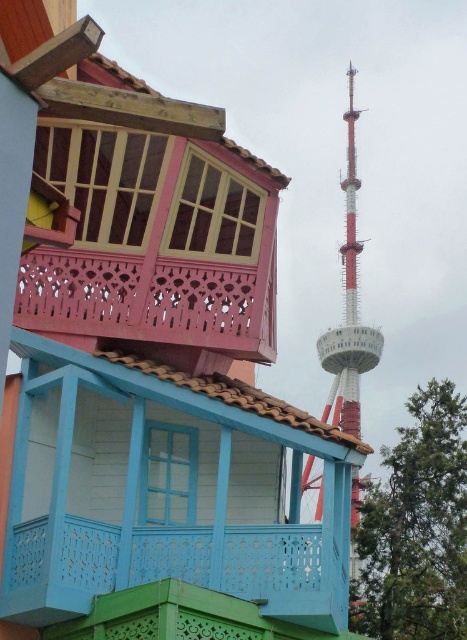
Question: Is pink woodwork balcony at upper left to the right of red and white painted tower at upper right from the viewer's perspective?

Choices:
 (A) no
 (B) yes

Answer: (A)

Question: Can you confirm if blue painted wood balcony at center is smaller than red and white painted tower at upper right?

Choices:
 (A) no
 (B) yes

Answer: (B)

Question: Which is farther from the pink woodwork balcony at upper left?

Choices:
 (A) blue painted wood balcony at center
 (B) red and white painted tower at upper right

Answer: (B)

Question: Does blue painted wood balcony at center come behind red and white painted tower at upper right?

Choices:
 (A) yes
 (B) no

Answer: (B)

Question: Which object is closer to the camera taking this photo?

Choices:
 (A) pink woodwork balcony at upper left
 (B) red and white painted tower at upper right

Answer: (A)

Question: Which object is positioned closest to the red and white painted tower at upper right?

Choices:
 (A) pink woodwork balcony at upper left
 (B) blue painted wood balcony at center

Answer: (B)